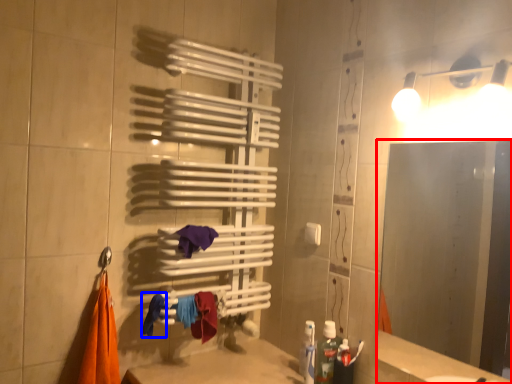
Question: Which point is closer to the camera, mirror (highlighted by a red box) or clothe (highlighted by a blue box)?

Choices:
 (A) mirror
 (B) clothe

Answer: (A)